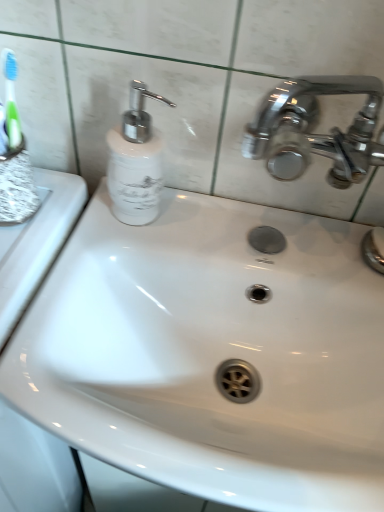
The image size is (384, 512). Identify the location of spots to the right of white glossy soap dispenser at upper left. (197, 223).